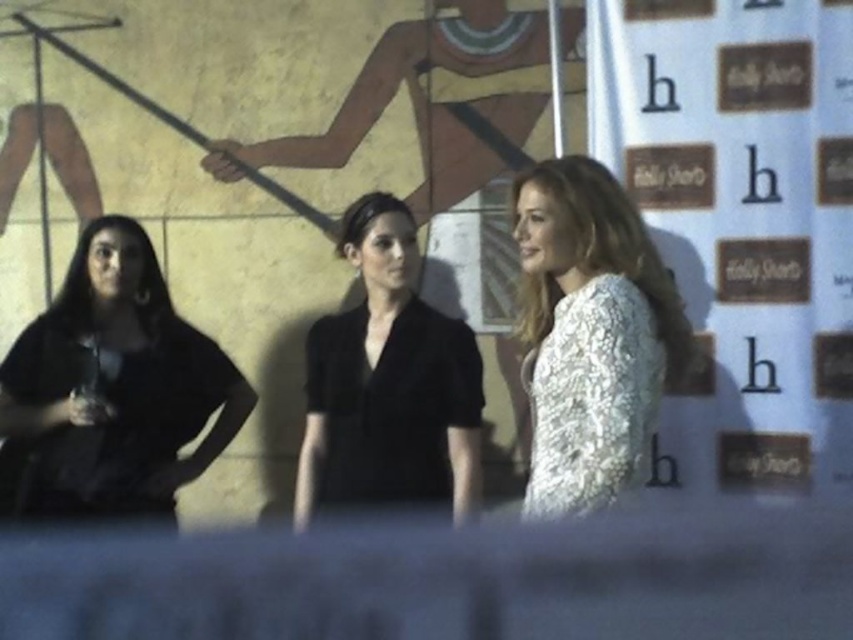
Which is below, matte black dress at left or smooth black blouse at center?

matte black dress at left is lower down.

Based on the photo, who is positioned more to the left, matte black dress at left or smooth black blouse at center?

Positioned to the left is matte black dress at left.

Is point (64, 483) farther from viewer compared to point (338, 252)?

That is False.

In order to click on matte black dress at left in this screenshot , I will do `click(111, 390)`.

Is black matte blazer at center shorter than white lace dress at right?

No.

Does black matte blazer at center appear under white lace dress at right?

No.

Does point (463, 461) lie in front of point (550, 342)?

That is False.

In order to click on black matte blazer at center in this screenshot , I will do `click(387, 384)`.

Consider the image. Is matte black dress at left positioned in front of white lace dress at right?

No, matte black dress at left is behind white lace dress at right.

Looking at this image, between matte black dress at left and white lace dress at right, which one is positioned lower?

white lace dress at right is below.

Locate an element on the screen. Image resolution: width=853 pixels, height=640 pixels. matte black dress at left is located at coordinates pyautogui.click(x=111, y=390).

This screenshot has height=640, width=853. Identify the location of matte black dress at left. (111, 390).